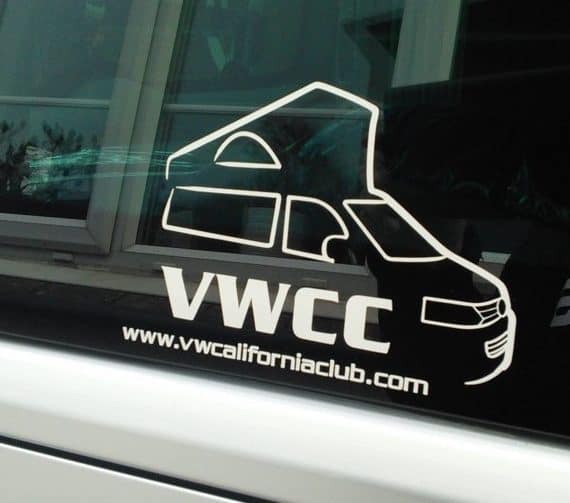
This screenshot has width=570, height=503. Find the location of `shaded window`. shaded window is located at coordinates (543, 112).